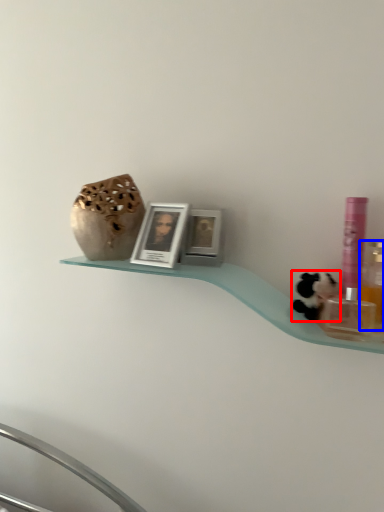
Question: Which object is closer to the camera taking this photo, animal (highlighted by a red box) or mouthwash (highlighted by a blue box)?

Choices:
 (A) animal
 (B) mouthwash

Answer: (B)